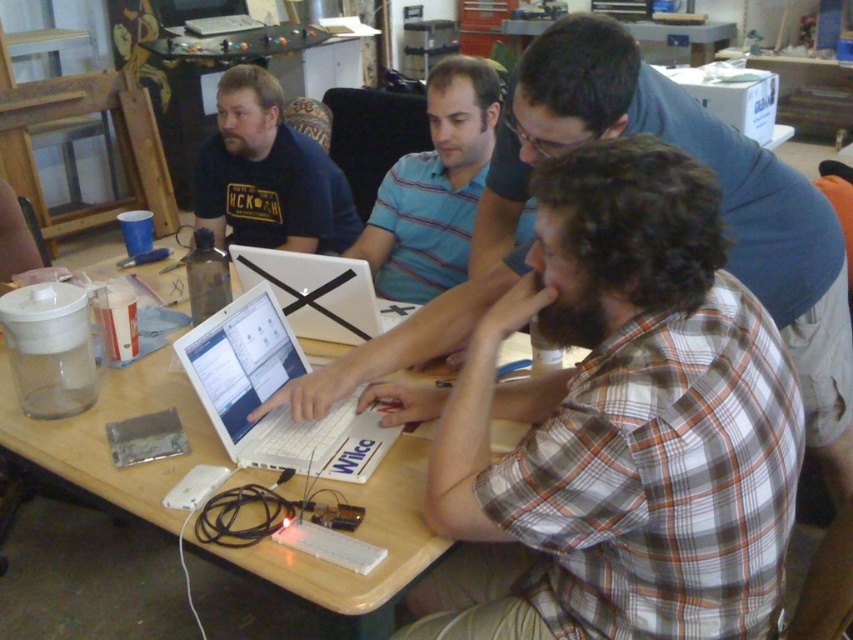
Is blue striped shirt at center thinner than white plastic laptop at center?

Incorrect, blue striped shirt at center's width is not less than white plastic laptop at center's.

Between blue striped shirt at center and white plastic laptop at center, which one appears on the right side from the viewer's perspective?

Positioned to the right is blue striped shirt at center.

Between point (434, 173) and point (177, 346), which one is positioned in front?

Point (177, 346)

You are a GUI agent. You are given a task and a screenshot of the screen. Output one action in this format:
    pyautogui.click(x=<x>, y=<y>)
    Task: Click on the blue striped shirt at center
    The width and height of the screenshot is (853, 640).
    Given the screenshot: What is the action you would take?
    pyautogui.click(x=434, y=188)

Measure the distance between blue striped shirt at center and matte black shirt at upper left.

blue striped shirt at center is 42.48 centimeters from matte black shirt at upper left.

Does blue striped shirt at center have a lesser width compared to matte black shirt at upper left?

Correct, blue striped shirt at center's width is less than matte black shirt at upper left's.

Does point (461, 84) lie behind point (267, 218)?

No, (461, 84) is closer to viewer.

Identify the location of blue striped shirt at center. (x=434, y=188).

Can you confirm if wooden table at center is positioned to the right of matte black shirt at upper left?

Correct, you'll find wooden table at center to the right of matte black shirt at upper left.

Which is behind, point (572, 360) or point (280, 188)?

Point (280, 188)

At what (x,y) coordinates should I click in order to perform the action: click on wooden table at center. Please return your answer as a coordinate pair (x, y). Looking at the image, I should click on (106, 438).